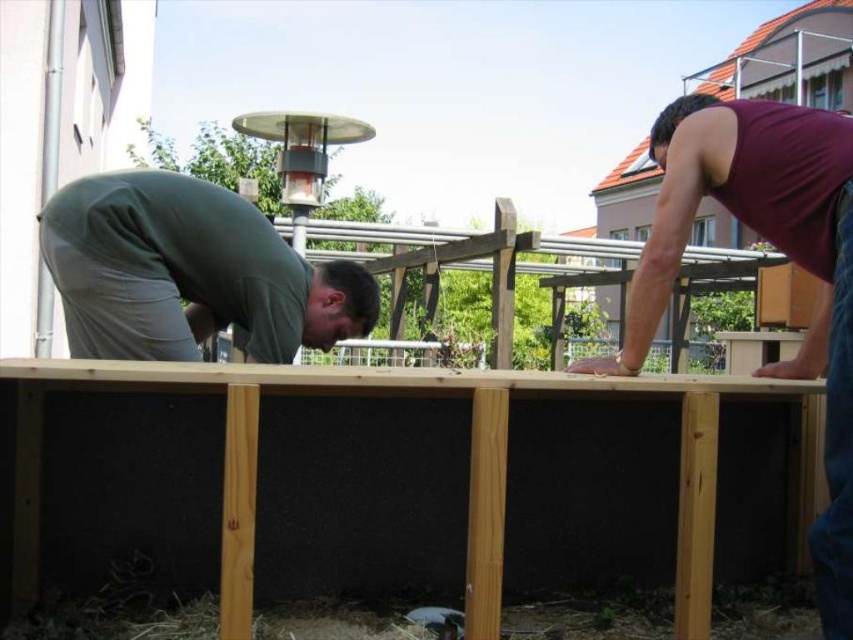
Question: Which of the following is the closest to the observer?

Choices:
 (A) (838, 365)
 (B) (746, 540)

Answer: (A)

Question: Is natural wood foundation at center to the left of green matte shirt at left from the viewer's perspective?

Choices:
 (A) no
 (B) yes

Answer: (A)

Question: Based on their relative distances, which object is farther from the maroon tank top at upper right?

Choices:
 (A) green matte shirt at left
 (B) natural wood foundation at center

Answer: (A)

Question: From the image, what is the correct spatial relationship of natural wood foundation at center in relation to maroon tank top at upper right?

Choices:
 (A) above
 (B) below

Answer: (B)

Question: Which of the following is the closest to the observer?

Choices:
 (A) (811, 214)
 (B) (119, 369)
 (C) (51, 276)

Answer: (B)

Question: Is natural wood foundation at center to the left of maroon tank top at upper right from the viewer's perspective?

Choices:
 (A) yes
 (B) no

Answer: (A)